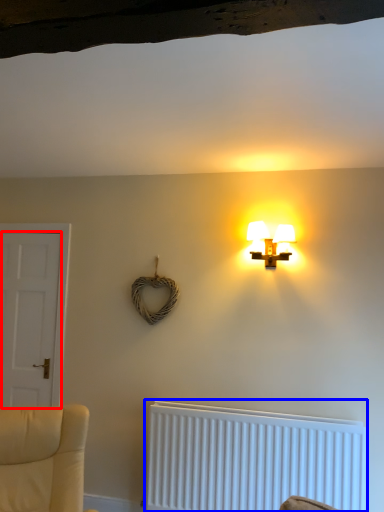
Question: Which point is further to the camera, door (highlighted by a red box) or radiator (highlighted by a blue box)?

Choices:
 (A) door
 (B) radiator

Answer: (A)